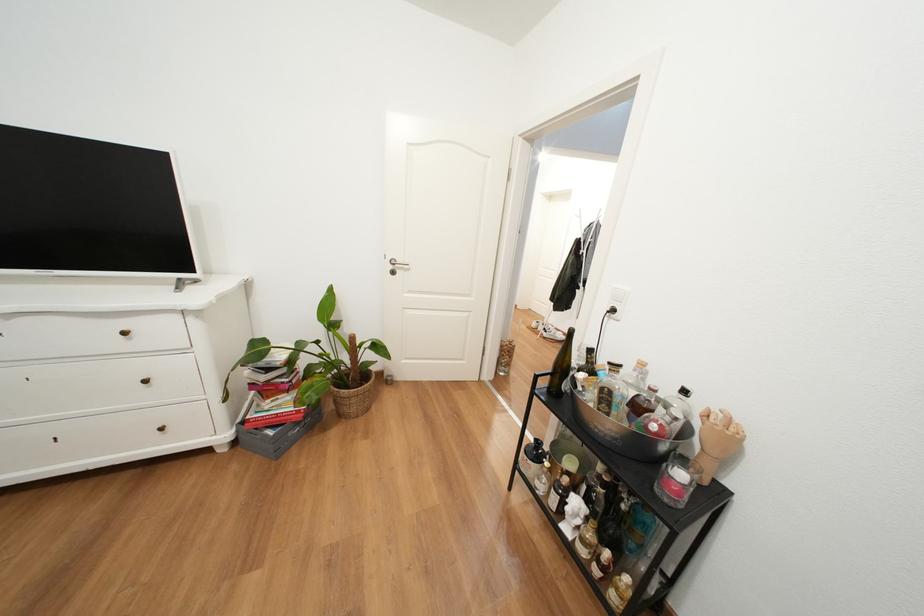
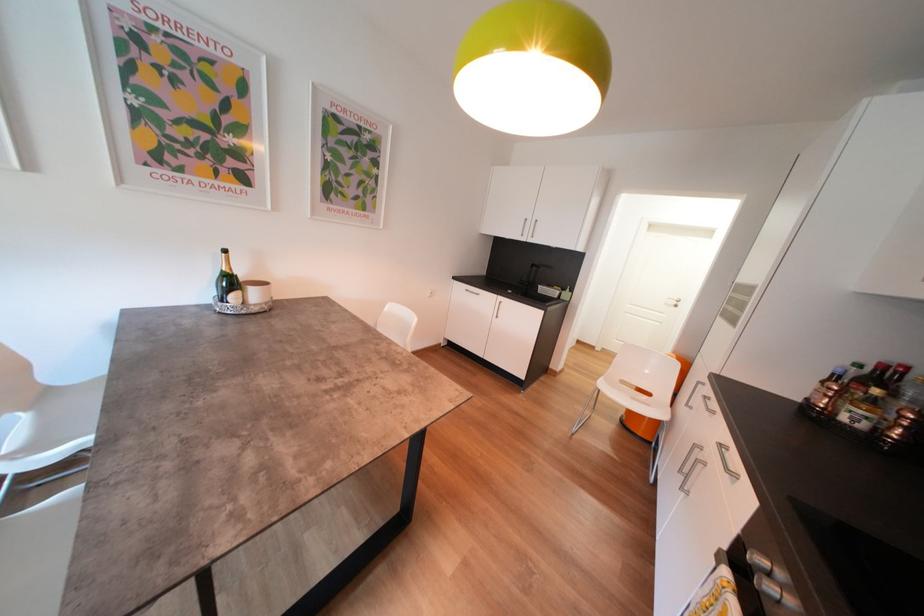
What movement of the cameraman would produce the second image?

The cameraman moved toward left, forward.